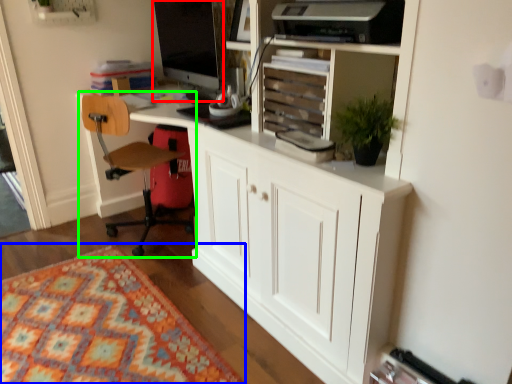
Question: Which is nearer to the computer monitor (highlighted by a red box)? mat (highlighted by a blue box) or chair (highlighted by a green box).

Choices:
 (A) mat
 (B) chair

Answer: (B)